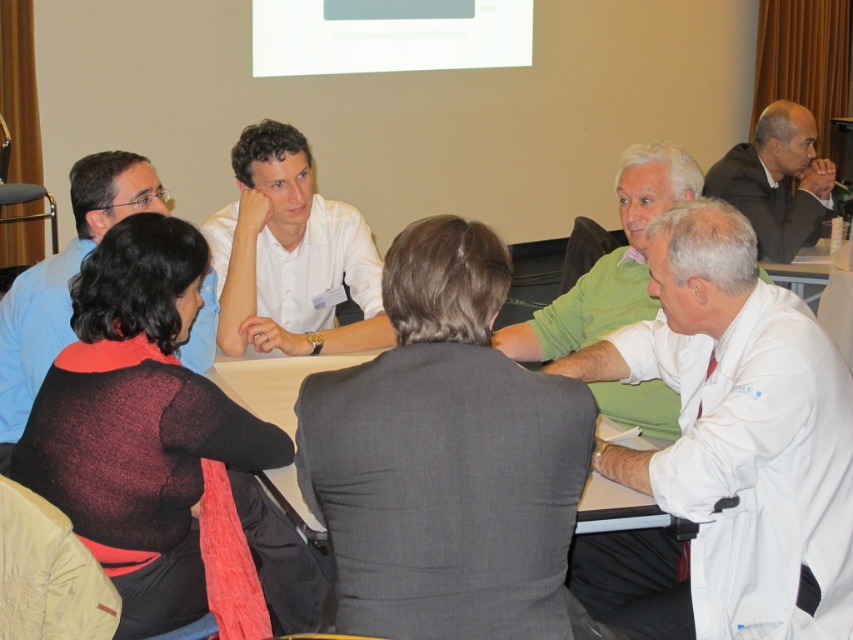
Question: Which object is positioned closest to the dark gray suit at upper right?

Choices:
 (A) matte black sweater at left
 (B) white smooth shirt at center

Answer: (B)

Question: Which point is closer to the camera taking this photo?

Choices:
 (A) (775, 227)
 (B) (283, 172)
 (C) (669, 426)
 (D) (41, 360)

Answer: (D)

Question: Is white smooth shirt at center wider than matte black sweater at left?

Choices:
 (A) yes
 (B) no

Answer: (A)

Question: Which object is closer to the camera taking this photo?

Choices:
 (A) dark gray suit at upper right
 (B) white smooth shirt at center

Answer: (B)

Question: Does white lab coat at center appear over white matte shirt at center?

Choices:
 (A) no
 (B) yes

Answer: (A)

Question: Can you confirm if white matte shirt at center is positioned below dark gray suit at upper right?

Choices:
 (A) no
 (B) yes

Answer: (B)